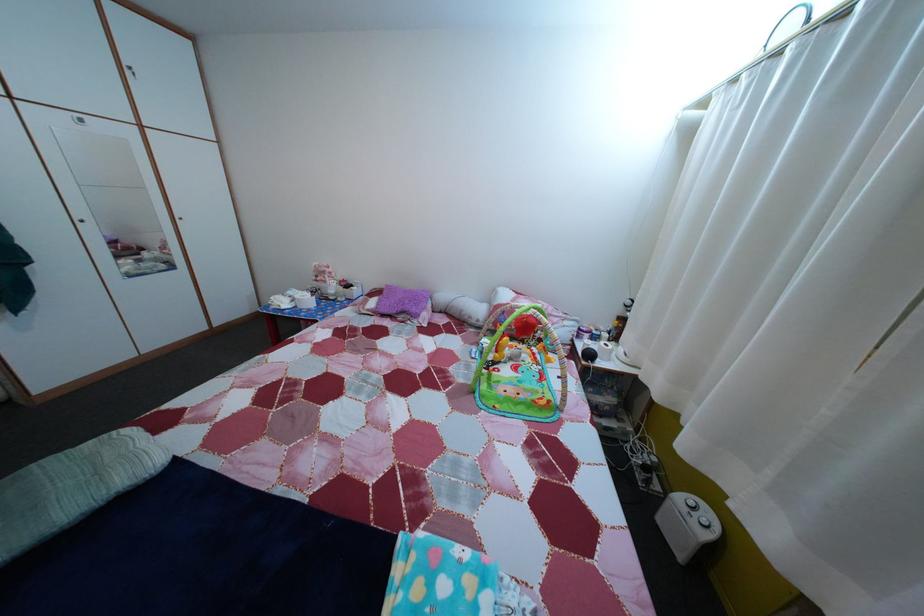
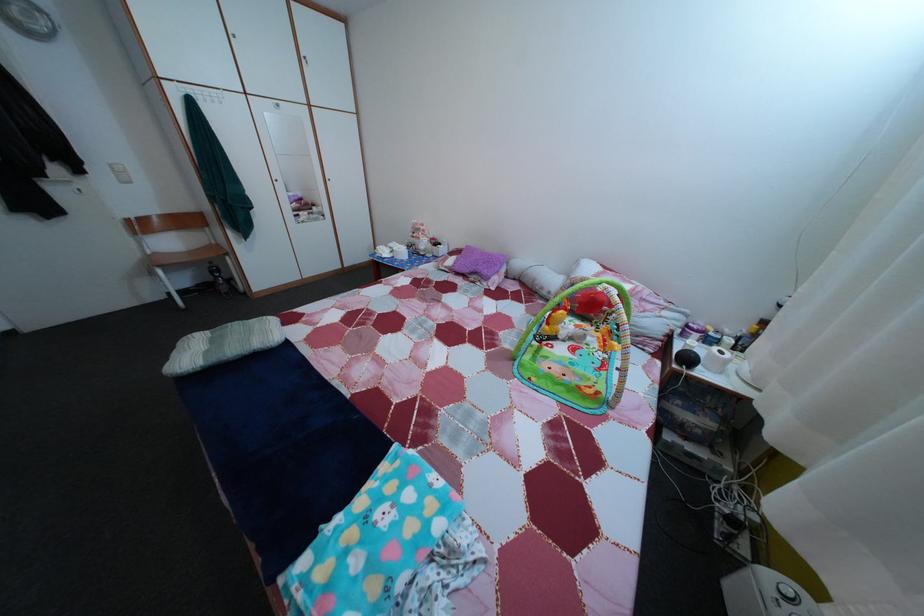
Where in the second image is the point corresponding to (416,299) from the first image?

(492, 261)